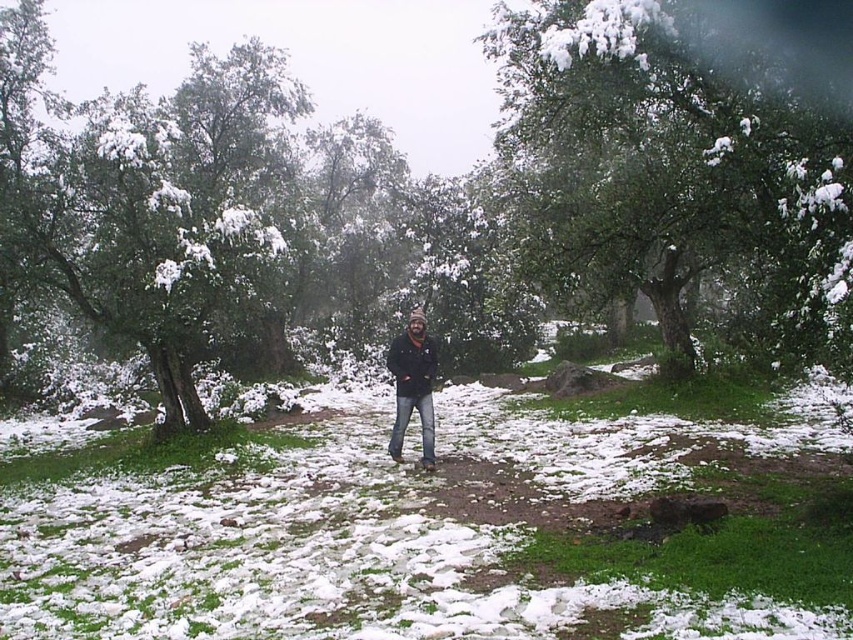
Question: Which point is farther from the camera taking this photo?

Choices:
 (A) pyautogui.click(x=403, y=372)
 (B) pyautogui.click(x=636, y=420)

Answer: (B)

Question: Is white fluffy snow at center below dark blue jeans at center?

Choices:
 (A) yes
 (B) no

Answer: (A)

Question: Which of the following is the closest to the observer?

Choices:
 (A) dark blue jeans at center
 (B) green textured tree at upper center
 (C) black matte jacket at center
 (D) white fluffy snow at center

Answer: (D)

Question: Does dark blue jeans at center have a smaller size compared to black matte jacket at center?

Choices:
 (A) yes
 (B) no

Answer: (B)

Question: Which of the following is the farthest from the observer?

Choices:
 (A) (821, 173)
 (B) (573, 602)

Answer: (B)

Question: From the image, what is the correct spatial relationship of green textured tree at upper center in relation to black matte jacket at center?

Choices:
 (A) left
 (B) right

Answer: (B)